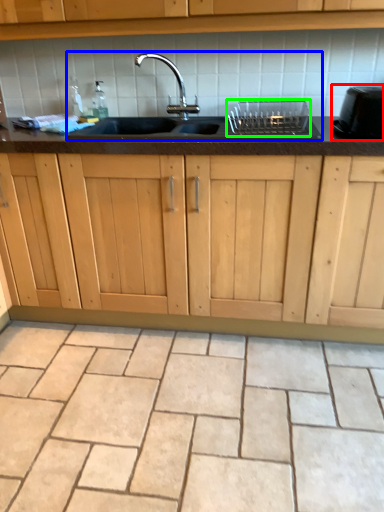
Question: Considering the real-world distances, which object is farthest from appliance (highlighted by a red box)? sink (highlighted by a blue box) or appliance (highlighted by a green box)?

Choices:
 (A) sink
 (B) appliance

Answer: (A)